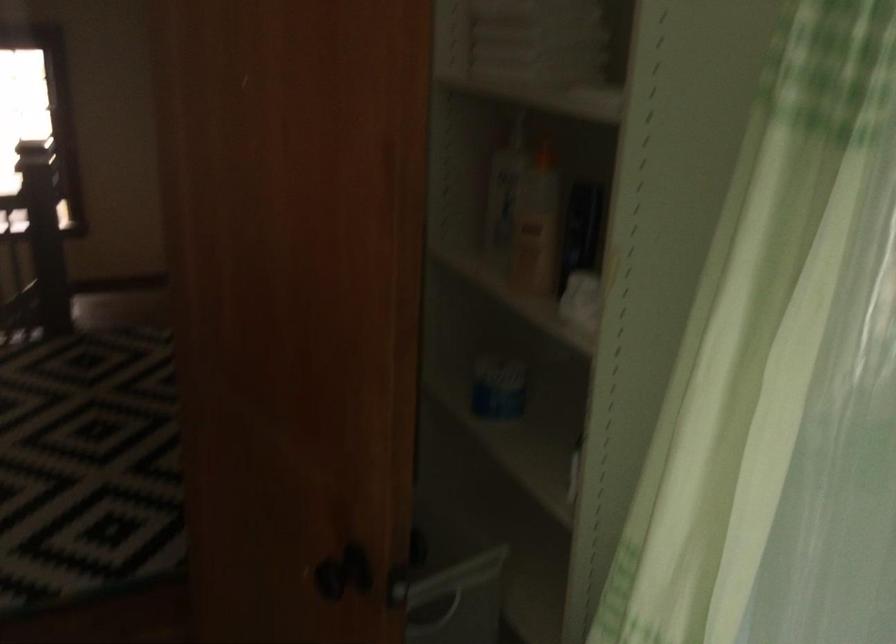
Locate an element on the screen. storage bin handle is located at coordinates (435, 621).